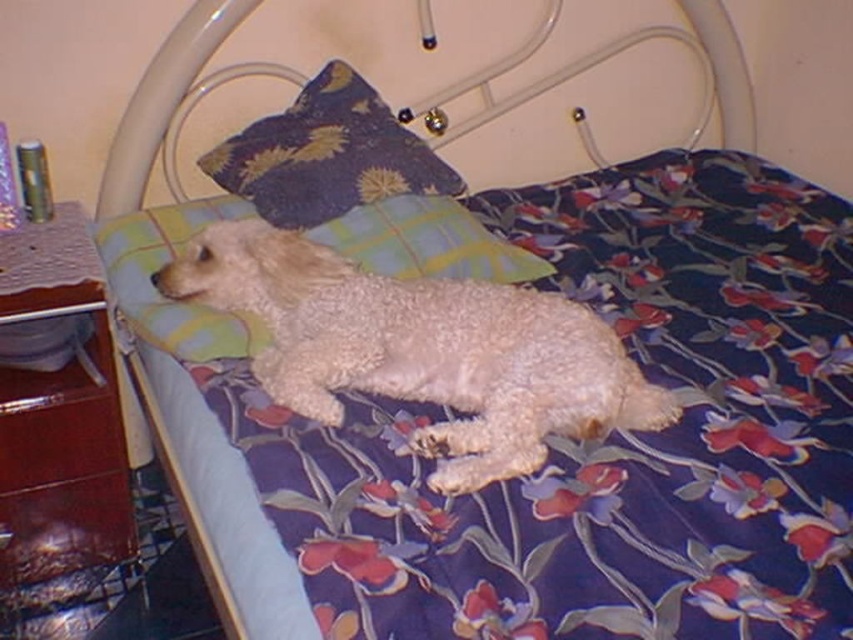
Measure the distance between white fluffy dog at center and camera.

A distance of 1.23 meters exists between white fluffy dog at center and camera.

Between white fluffy dog at center and green plaid pillow at upper center, which one is positioned higher?

Positioned higher is green plaid pillow at upper center.

Between point (450, 376) and point (318, 236), which one is positioned behind?

Point (318, 236)

Image resolution: width=853 pixels, height=640 pixels. I want to click on white fluffy dog at center, so click(421, 349).

This screenshot has height=640, width=853. What do you see at coordinates (166, 298) in the screenshot?
I see `green plaid pillow at upper center` at bounding box center [166, 298].

Measure the distance from green plaid pillow at upper center to dark blue fabric pillow at upper center.

They are 6.19 inches apart.

Locate an element on the screen. This screenshot has height=640, width=853. green plaid pillow at upper center is located at coordinates (166, 298).

How distant is white fluffy dog at center from dark blue fabric pillow at upper center?

The distance of white fluffy dog at center from dark blue fabric pillow at upper center is 17.47 inches.

Is white fluffy dog at center below dark blue fabric pillow at upper center?

Indeed, white fluffy dog at center is positioned under dark blue fabric pillow at upper center.

Does point (463, 352) come farther from viewer compared to point (364, 131)?

No, (463, 352) is closer to viewer.

At what (x,y) coordinates should I click in order to perform the action: click on white fluffy dog at center. Please return your answer as a coordinate pair (x, y). The image size is (853, 640). Looking at the image, I should click on (421, 349).